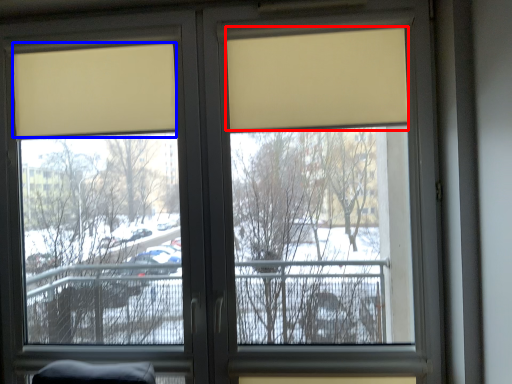
Question: Which of the following is the farthest to the observer, curtain (highlighted by a red box) or curtain (highlighted by a blue box)?

Choices:
 (A) curtain
 (B) curtain

Answer: (B)